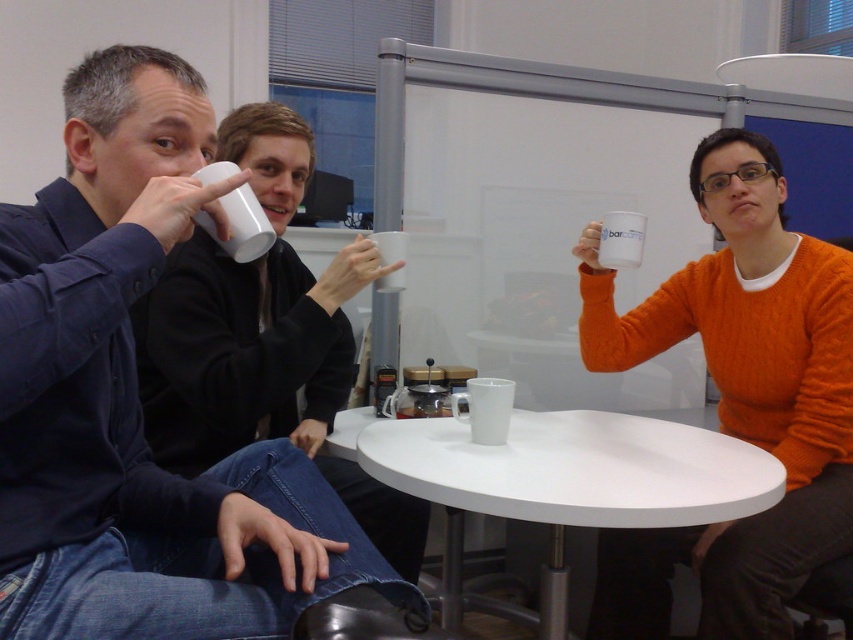
You are a photographer trying to capture a candid shot of the two people holding white mugs. You notice the white matte mug at upper right and the white matte mug at center. Which mug is located to the right of the other?

The white matte mug at upper right is positioned on the right side of white matte mug at center.

You are a photographer setting up for a group photo. The white matte mug at upper right is an important element to include in the frame. Where should you position your camera relative to the group to ensure the mug is centered in the photo?

To center the white matte mug at upper right in the photo, position the camera directly facing the mug, aligning it with the frame center using its coordinates at point (621, 240).

You are a barista who needs to prepare two different sized drinks for customers. The white matte mug at upper right and the white matte mug at center are available. Which mug should you choose if you need to serve a taller drink?

The white matte mug at center is taller than the white matte mug at upper right, so you should choose the white matte mug at center to serve a taller drink.